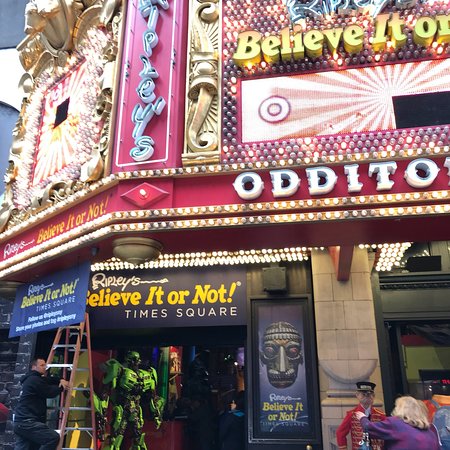
In order to click on skull picture in this screenshot , I will do `click(284, 350)`.